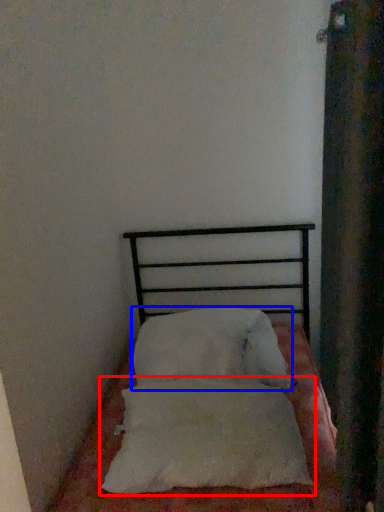
Question: Among these objects, which one is farthest to the camera, pillow (highlighted by a red box) or pillow (highlighted by a blue box)?

Choices:
 (A) pillow
 (B) pillow

Answer: (B)